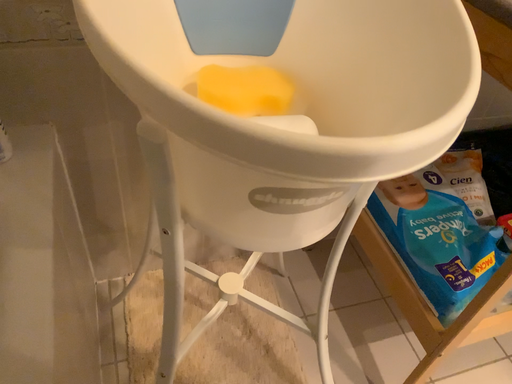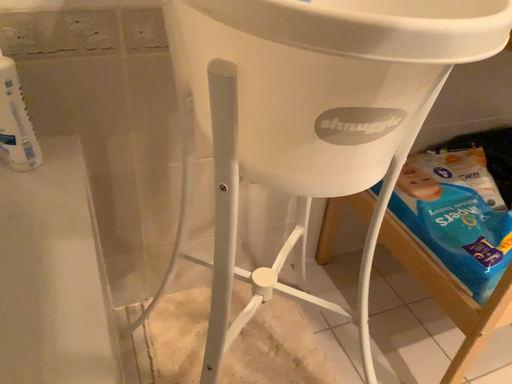
Question: How did the camera likely rotate when shooting the video?

Choices:
 (A) rotated upward
 (B) rotated downward

Answer: (A)